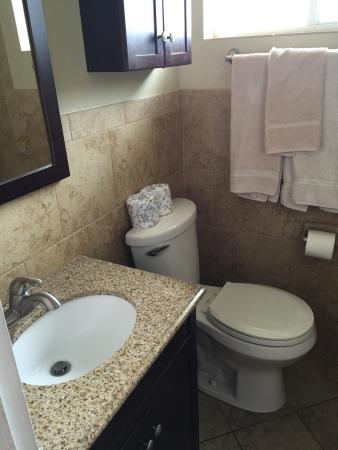
Find the location of `wall tiles`. wall tiles is located at coordinates (30, 236), (129, 162), (89, 179), (205, 135), (270, 244), (264, 224), (113, 237), (64, 244), (223, 263).